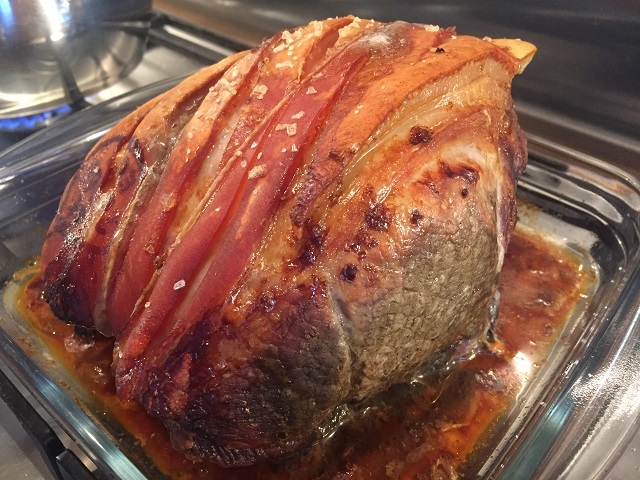
This screenshot has height=480, width=640. Identify the location of cooking pot. (57, 33).